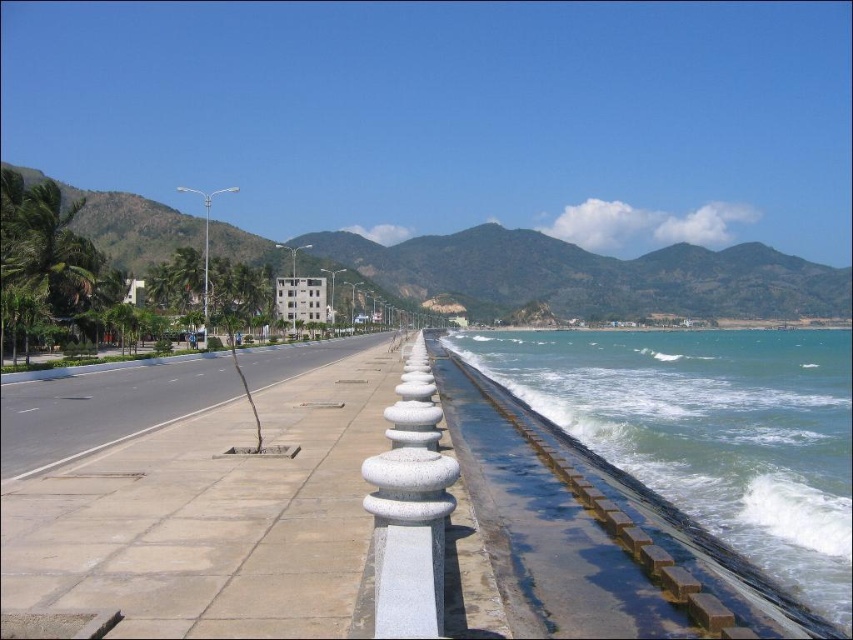
Between point (161, 531) and point (631, 332), which one is positioned in front?

Point (161, 531) is more forward.

Between point (39, 570) and point (682, 346), which one is positioned behind?

Positioned behind is point (682, 346).

Between point (143, 529) and point (811, 550), which one is positioned behind?

The point (811, 550) is behind.

Locate an element on the screen. Image resolution: width=853 pixels, height=640 pixels. light gray concrete sidewalk at center is located at coordinates [x=212, y=516].

Image resolution: width=853 pixels, height=640 pixels. I want to click on greenish-blue water at lower right, so click(x=708, y=440).

Does greenish-blue water at lower right have a greater width compared to white stone pillar at center?

Correct, the width of greenish-blue water at lower right exceeds that of white stone pillar at center.

Does point (735, 440) lie in front of point (401, 595)?

No, it is behind (401, 595).

This screenshot has height=640, width=853. Identify the location of greenish-blue water at lower right. (708, 440).

Looking at this image, which is more to the left, light gray concrete sidewalk at center or white stone pillar at center?

Positioned to the left is light gray concrete sidewalk at center.

Between light gray concrete sidewalk at center and white stone pillar at center, which one has more height?

Standing taller between the two is white stone pillar at center.

Find the location of a particular element. light gray concrete sidewalk at center is located at coordinates (212, 516).